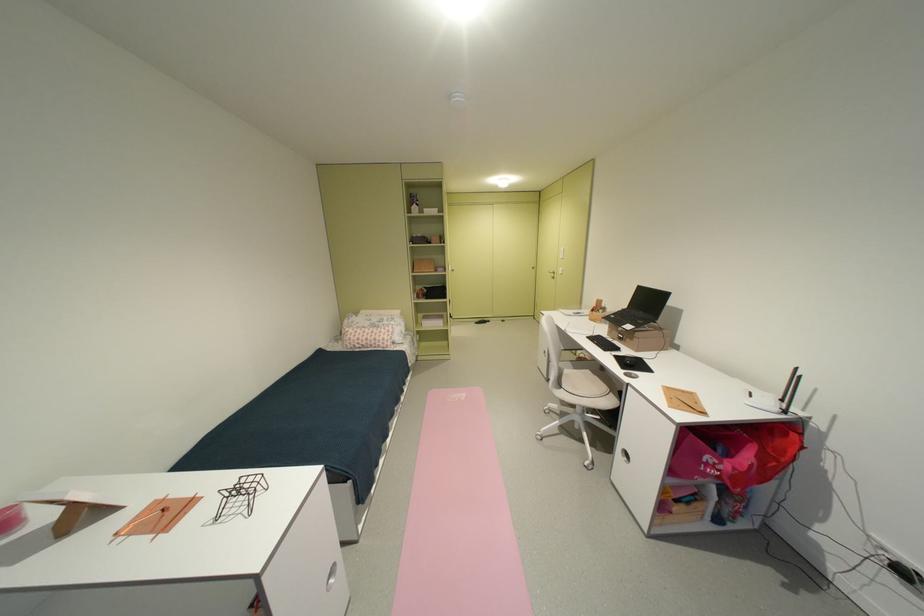
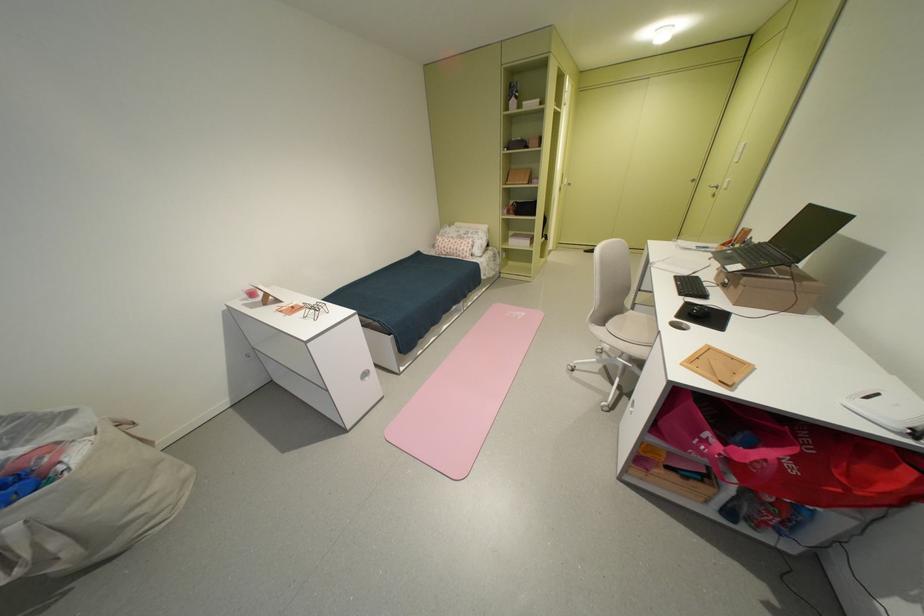
The point at (693, 392) is marked in the first image. Where is the corresponding point in the second image?

(743, 360)